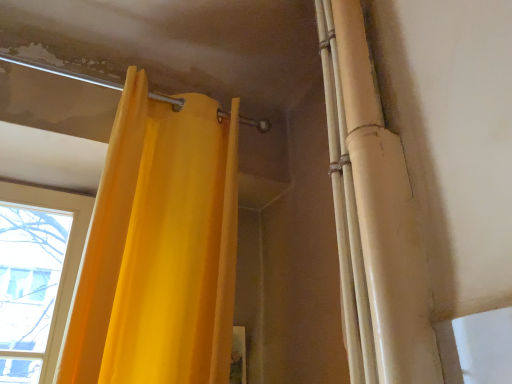
Question: Is matte yellow curtain at upper right far from matte yellow curtain at upper left?

Choices:
 (A) yes
 (B) no

Answer: (B)

Question: From a real-world perspective, is matte yellow curtain at upper right positioned under matte yellow curtain at upper left based on gravity?

Choices:
 (A) no
 (B) yes

Answer: (A)

Question: Does matte yellow curtain at upper right have a greater width compared to matte yellow curtain at upper left?

Choices:
 (A) yes
 (B) no

Answer: (B)

Question: Is matte yellow curtain at upper right closer to the viewer compared to matte yellow curtain at upper left?

Choices:
 (A) yes
 (B) no

Answer: (A)

Question: Does matte yellow curtain at upper right turn towards matte yellow curtain at upper left?

Choices:
 (A) no
 (B) yes

Answer: (A)

Question: Can you confirm if matte yellow curtain at upper right is smaller than matte yellow curtain at upper left?

Choices:
 (A) no
 (B) yes

Answer: (B)

Question: Does matte yellow curtain at upper left turn towards matte yellow curtain at upper right?

Choices:
 (A) yes
 (B) no

Answer: (A)

Question: Can you confirm if matte yellow curtain at upper left is shorter than matte yellow curtain at upper right?

Choices:
 (A) yes
 (B) no

Answer: (A)

Question: Is matte yellow curtain at upper left outside of matte yellow curtain at upper right?

Choices:
 (A) no
 (B) yes

Answer: (B)

Question: Is matte yellow curtain at upper left facing away from matte yellow curtain at upper right?

Choices:
 (A) yes
 (B) no

Answer: (B)

Question: Would you consider matte yellow curtain at upper left to be distant from matte yellow curtain at upper right?

Choices:
 (A) yes
 (B) no

Answer: (B)

Question: From a real-world perspective, is matte yellow curtain at upper left physically below matte yellow curtain at upper right?

Choices:
 (A) no
 (B) yes

Answer: (B)

Question: Would you say matte yellow curtain at upper left is inside or outside matte yellow curtain at upper right?

Choices:
 (A) inside
 (B) outside

Answer: (B)